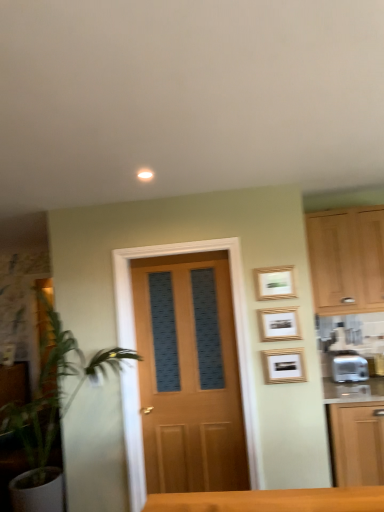
Question: From the image's perspective, does gold-framed picture at upper right, which is counted as the 3th picture frame, starting from the bottom, appear lower than gold-framed picture at center-right, which appears as the 3th picture frame when viewed from the top?

Choices:
 (A) yes
 (B) no

Answer: (B)

Question: Is gold-framed picture at center-right, which appears as the 3th picture frame when viewed from the top, at the back of gold-framed picture at upper right, the first picture frame from the top?

Choices:
 (A) no
 (B) yes

Answer: (A)

Question: Is gold-framed picture at upper right, which is counted as the 3th picture frame, starting from the bottom, shorter than gold-framed picture at center-right, which appears as the 3th picture frame when viewed from the top?

Choices:
 (A) yes
 (B) no

Answer: (A)

Question: Does gold-framed picture at upper right, which is counted as the 3th picture frame, starting from the bottom, lie behind gold-framed picture at center-right, the 1th picture frame from the bottom?

Choices:
 (A) yes
 (B) no

Answer: (A)

Question: Is gold-framed picture at upper right, the first picture frame from the top, thinner than gold-framed picture at center-right, which appears as the 3th picture frame when viewed from the top?

Choices:
 (A) no
 (B) yes

Answer: (A)

Question: Considering the positions of gold-framed picture at upper right, which ranks as the 2th picture frame in top-to-bottom order, and wooden door at center in the image, is gold-framed picture at upper right, which ranks as the 2th picture frame in top-to-bottom order, wider or thinner than wooden door at center?

Choices:
 (A) thin
 (B) wide

Answer: (A)

Question: Is point (296, 330) closer or farther from the camera than point (145, 268)?

Choices:
 (A) farther
 (B) closer

Answer: (B)

Question: Choose the correct answer: Is gold-framed picture at upper right, arranged as the second picture frame when ordered from the bottom, inside wooden door at center or outside it?

Choices:
 (A) outside
 (B) inside

Answer: (A)

Question: Based on their sizes in the image, would you say gold-framed picture at upper right, which ranks as the 2th picture frame in top-to-bottom order, is bigger or smaller than wooden door at center?

Choices:
 (A) small
 (B) big

Answer: (A)

Question: From a real-world perspective, is gold-framed picture at upper right, which ranks as the 2th picture frame in top-to-bottom order, positioned above or below gold-framed picture at center-right, the 1th picture frame from the bottom?

Choices:
 (A) above
 (B) below

Answer: (A)

Question: Is point pos(286,332) closer or farther from the camera than point pos(269,355)?

Choices:
 (A) closer
 (B) farther

Answer: (A)

Question: Is gold-framed picture at upper right, which ranks as the 2th picture frame in top-to-bottom order, wider or thinner than gold-framed picture at center-right, which appears as the 3th picture frame when viewed from the top?

Choices:
 (A) wide
 (B) thin

Answer: (A)

Question: Is gold-framed picture at upper right, arranged as the second picture frame when ordered from the bottom, situated inside gold-framed picture at center-right, which appears as the 3th picture frame when viewed from the top, or outside?

Choices:
 (A) outside
 (B) inside

Answer: (A)

Question: Is gold-framed picture at upper right, the first picture frame from the top, in front of or behind light wood cabinet at right, which ranks as the second cabinetry in left-to-right order, in the image?

Choices:
 (A) front
 (B) behind

Answer: (A)

Question: Based on their sizes in the image, would you say gold-framed picture at upper right, which is counted as the 3th picture frame, starting from the bottom, is bigger or smaller than light wood cabinet at right, the first cabinetry from the right?

Choices:
 (A) big
 (B) small

Answer: (B)